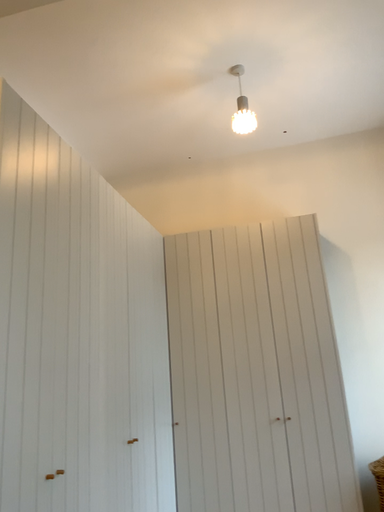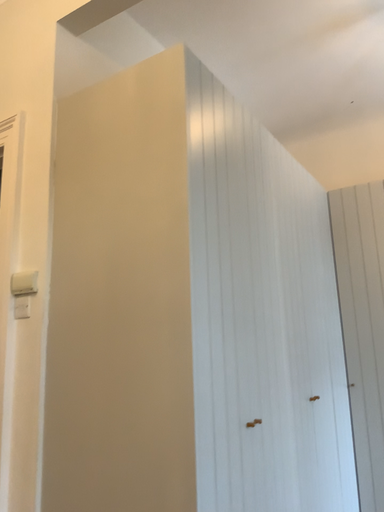
Question: How did the camera likely rotate when shooting the video?

Choices:
 (A) rotated left
 (B) rotated right

Answer: (A)